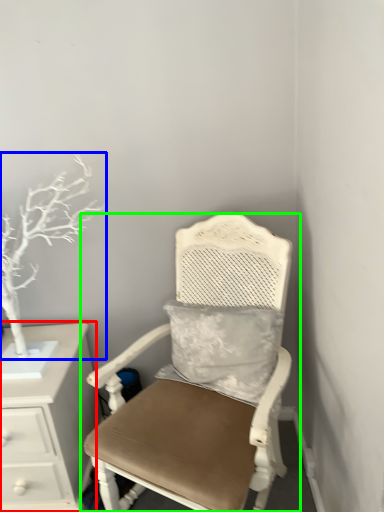
Question: Based on their relative distances, which object is farther from chest of drawers (highlighted by a red box)? Choose from tree (highlighted by a blue box) and chair (highlighted by a green box).

Choices:
 (A) tree
 (B) chair

Answer: (B)